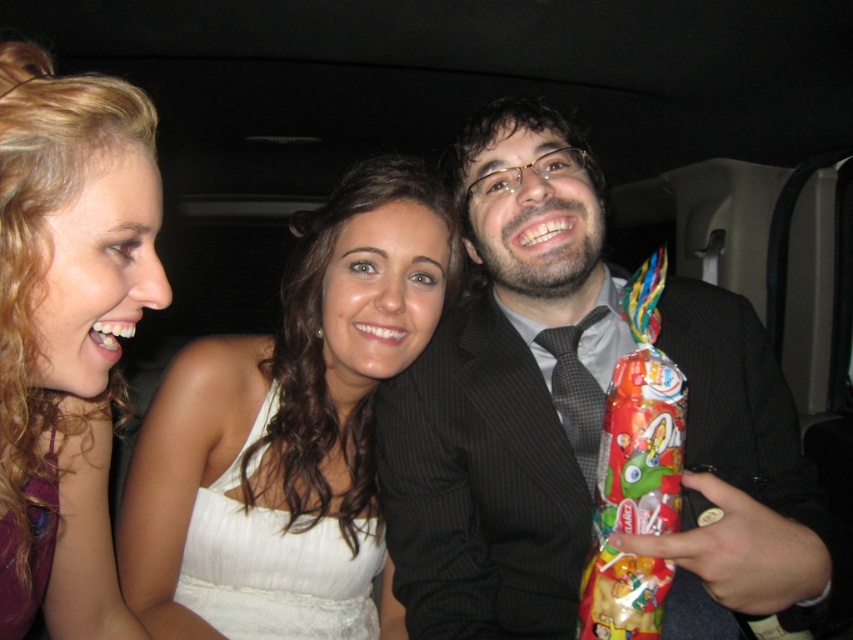
Is point (292, 422) farther from viewer compared to point (39, 396)?

Yes.

In the scene shown: Which is below, white satin dress at center or blonde curly hair at upper left?

white satin dress at center is below.

You are a GUI agent. You are given a task and a screenshot of the screen. Output one action in this format:
    pyautogui.click(x=<x>, y=<y>)
    Task: Click on the white satin dress at center
    The width and height of the screenshot is (853, 640).
    Given the screenshot: What is the action you would take?
    pyautogui.click(x=293, y=404)

Is black pinstripe suit at center wider than white satin dress at center?

Yes, black pinstripe suit at center is wider than white satin dress at center.

You are a GUI agent. You are given a task and a screenshot of the screen. Output one action in this format:
    pyautogui.click(x=<x>, y=<y>)
    Task: Click on the black pinstripe suit at center
    This screenshot has height=640, width=853.
    Given the screenshot: What is the action you would take?
    pyautogui.click(x=506, y=392)

Is point (688, 337) positioned after point (329, 333)?

That is False.

The width and height of the screenshot is (853, 640). In order to click on black pinstripe suit at center in this screenshot , I will do `click(506, 392)`.

Does black pinstripe suit at center come behind blonde curly hair at upper left?

That is True.

Locate an element on the screen. This screenshot has height=640, width=853. black pinstripe suit at center is located at coordinates (506, 392).